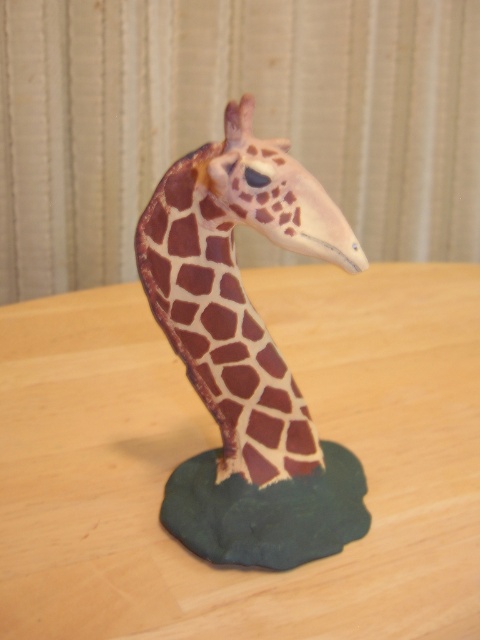
Between wooden table at center and matte brown giraffe at center, which one has less height?

wooden table at center

Which is in front, point (354, 294) or point (236, 275)?

Positioned in front is point (236, 275).

Find the location of a particular element. The height and width of the screenshot is (640, 480). wooden table at center is located at coordinates (219, 444).

Find the location of `wooden table at center`. wooden table at center is located at coordinates (219, 444).